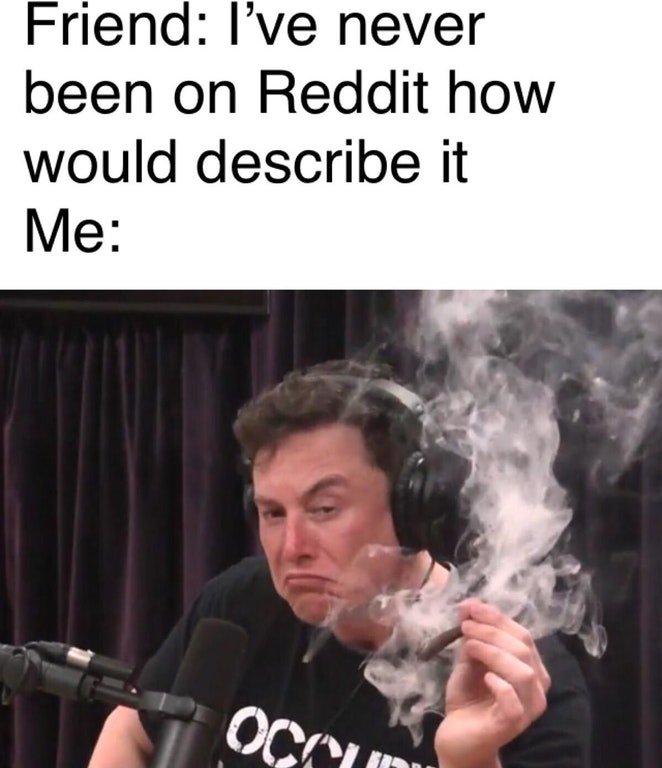
Locate an element on the screen. purple curtain is located at coordinates (113, 512).